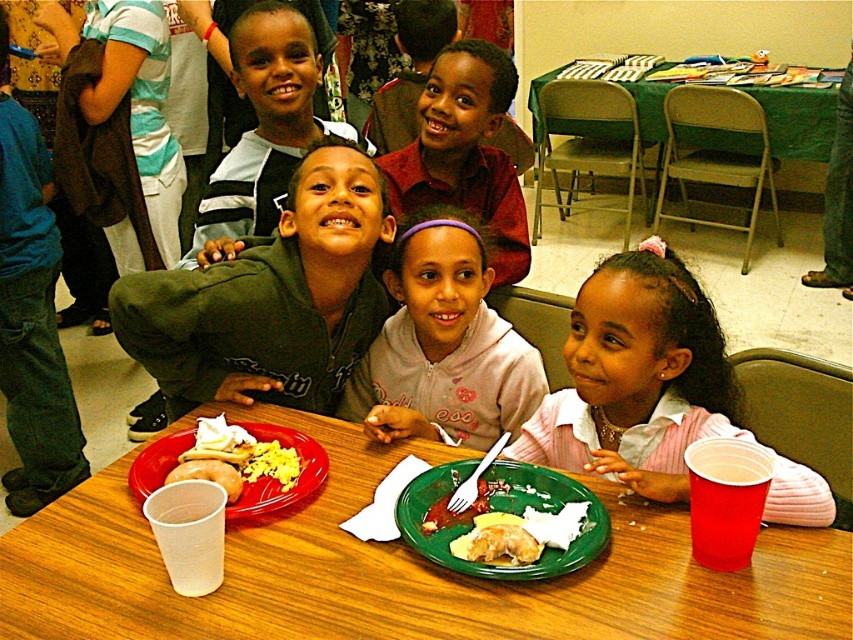
Who is more distant from viewer, (666, 432) or (357, 388)?

Positioned behind is point (357, 388).

Does point (556, 445) come behind point (440, 416)?

No, it is in front of (440, 416).

The width and height of the screenshot is (853, 640). In order to click on pink fabric shirt at center in this screenshot , I will do `click(636, 378)`.

How far apart are yellow scrambled eggs at center and white plastic cup at lower left?

They are 1.55 inches apart.

Who is shorter, yellow scrambled eggs at center or white plastic cup at lower left?

white plastic cup at lower left

Between point (202, 419) and point (241, 483), which one is positioned in front?

Positioned in front is point (241, 483).

Where is `yellow scrambled eggs at center`? This screenshot has height=640, width=853. yellow scrambled eggs at center is located at coordinates (238, 456).

Who is shorter, pink fleece hoodie at center or matte green jacket at center?

pink fleece hoodie at center is shorter.

Does pink fleece hoodie at center come in front of matte green jacket at center?

Yes, pink fleece hoodie at center is closer to the viewer.

This screenshot has width=853, height=640. What do you see at coordinates (442, 344) in the screenshot?
I see `pink fleece hoodie at center` at bounding box center [442, 344].

Identify the location of pink fleece hoodie at center. (442, 344).